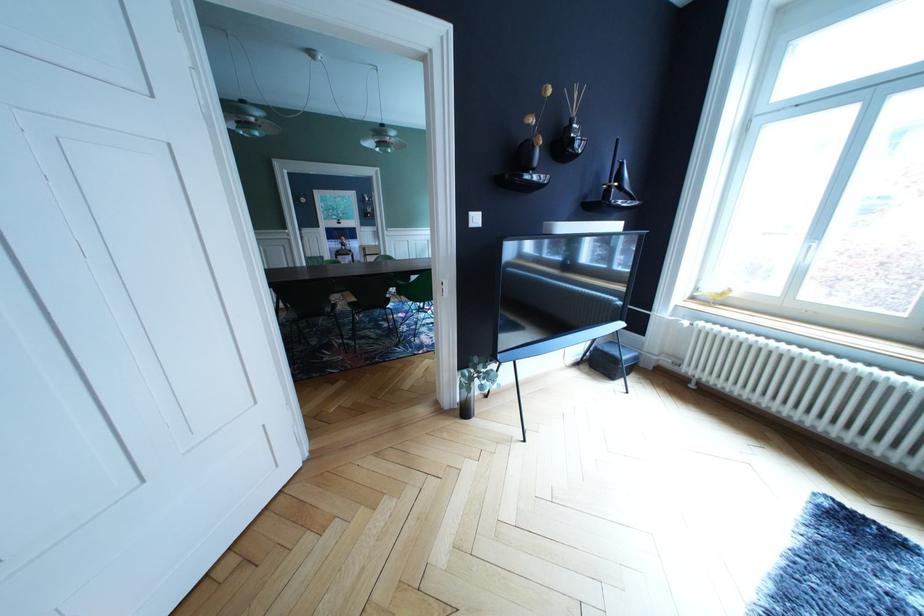
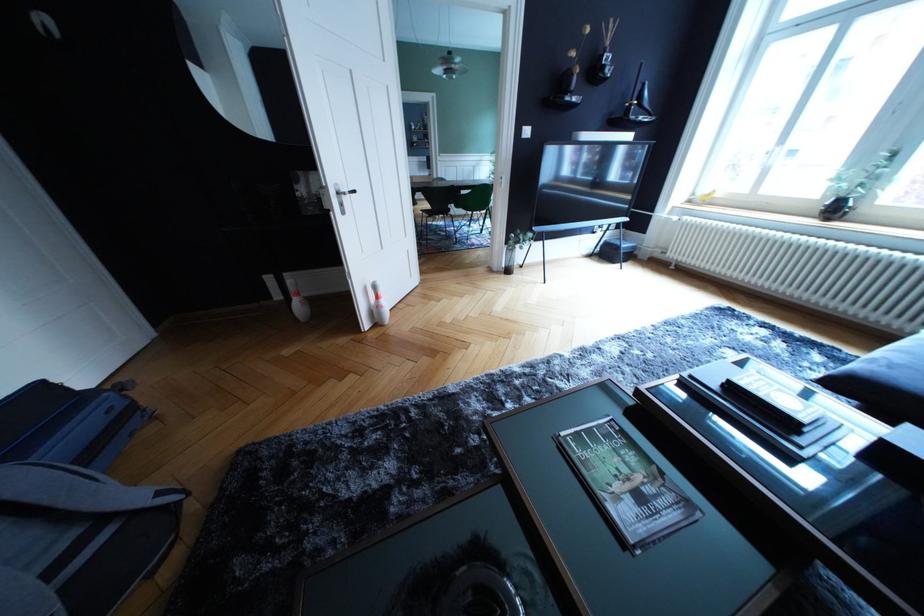
In the second image, find the point that corresponds to point 628,184 in the first image.

(648, 103)